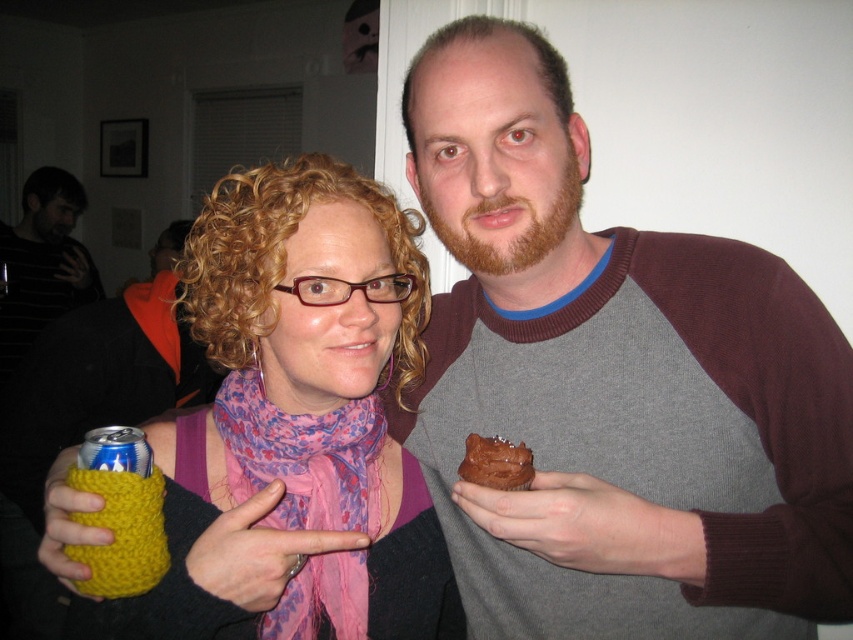
Question: Does yellow knitted can at lower left appear under chocolate matte cake at center?

Choices:
 (A) no
 (B) yes

Answer: (B)

Question: Does yellow knitted can at left appear on the right side of chocolate matte cake at center?

Choices:
 (A) yes
 (B) no

Answer: (B)

Question: Can you confirm if yellow knitted can at left is smaller than yellow knitted can at lower left?

Choices:
 (A) yes
 (B) no

Answer: (B)

Question: Which object is positioned farthest from the pink floral scarf at center?

Choices:
 (A) gray marled sweater at center
 (B) yellow knitted can at lower left
 (C) chocolate matte cake at center
 (D) yellow knitted can at left

Answer: (A)

Question: Which is farther from the chocolate matte cake at center?

Choices:
 (A) yellow knitted can at lower left
 (B) yellow knitted can at left
 (C) gray marled sweater at center
 (D) pink floral scarf at center

Answer: (A)

Question: Which point is closer to the camera taking this photo?

Choices:
 (A) (792, 474)
 (B) (119, 504)

Answer: (B)